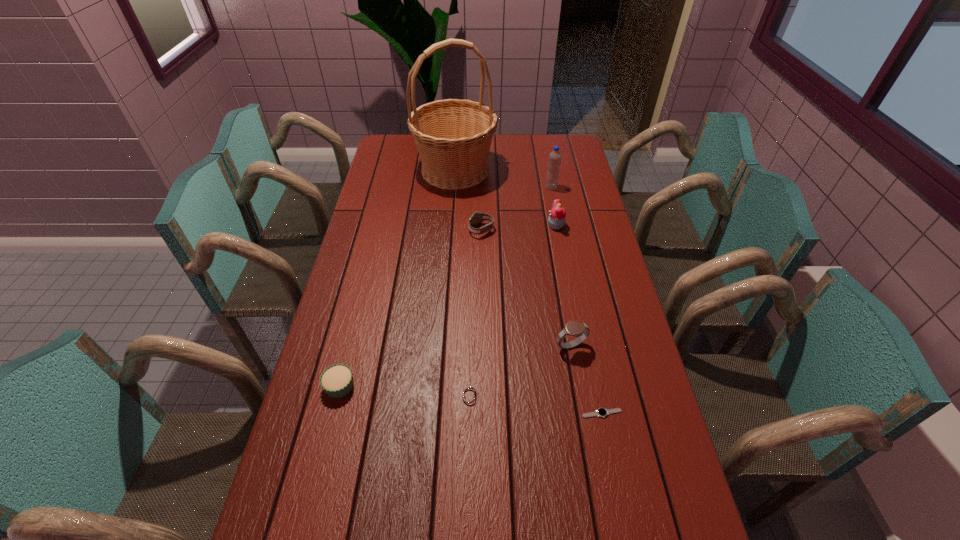
This screenshot has width=960, height=540. In order to click on vacant point that satisfies the following two spatial constraints: 1. on the back side of the basket; 2. on the left side of the sixth tallest object in this screenshot , I will do `click(393, 170)`.

Where is `free space that satisfies the following two spatial constraints: 1. on the face of the third shortest watch; 2. on the back side of the shortest watch`? The height and width of the screenshot is (540, 960). free space that satisfies the following two spatial constraints: 1. on the face of the third shortest watch; 2. on the back side of the shortest watch is located at coordinates (482, 413).

Identify the location of vacant space that satisfies the following two spatial constraints: 1. on the face of the second tallest watch; 2. on the back side of the shortest object. (482, 413).